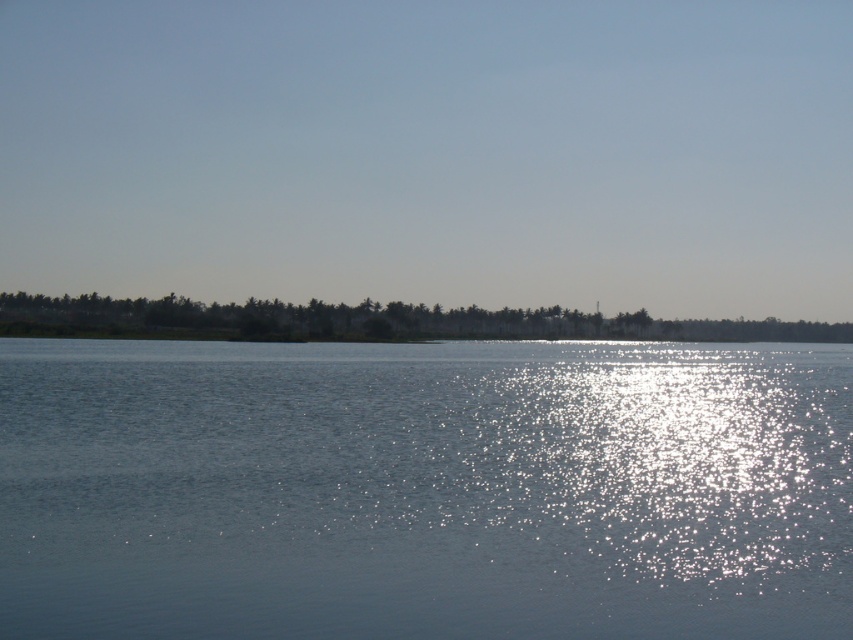
Question: From the image, what is the correct spatial relationship of clear water at center in relation to green leafy trees at lower center?

Choices:
 (A) right
 (B) left

Answer: (A)

Question: In this image, where is clear water at center located relative to green leafy trees at lower center?

Choices:
 (A) above
 (B) below

Answer: (B)

Question: Which of the following is the closest to the observer?

Choices:
 (A) click(570, 461)
 (B) click(247, 314)

Answer: (A)

Question: Among these points, which one is farthest from the camera?

Choices:
 (A) (625, 545)
 (B) (276, 321)

Answer: (B)

Question: Which point is farther to the camera?

Choices:
 (A) clear water at center
 (B) green leafy trees at lower center

Answer: (B)

Question: Is clear water at center wider than green leafy trees at lower center?

Choices:
 (A) yes
 (B) no

Answer: (B)